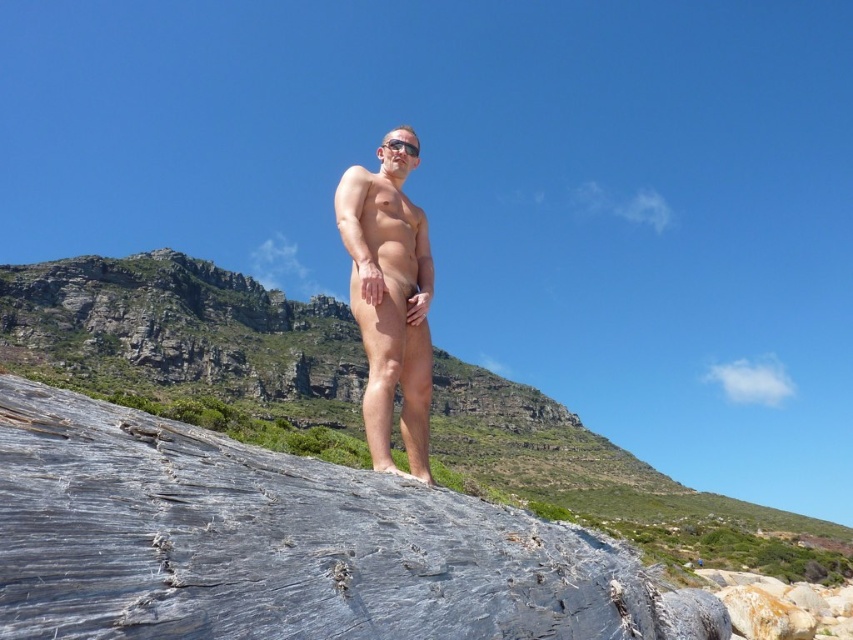
You are a geologist examining the image and want to locate the gray rough rock at center. According to the coordinates provided, where would you find it?

The gray rough rock at center is located at point (184, 339).

You are a photographer trying to capture the perfect shot of the gray rough rock at center and the matte skin at center. To ensure both are in frame, you need to know their relative positions. Which object is positioned to the left of the other?

The gray rough rock at center is to the left of matte skin at center.